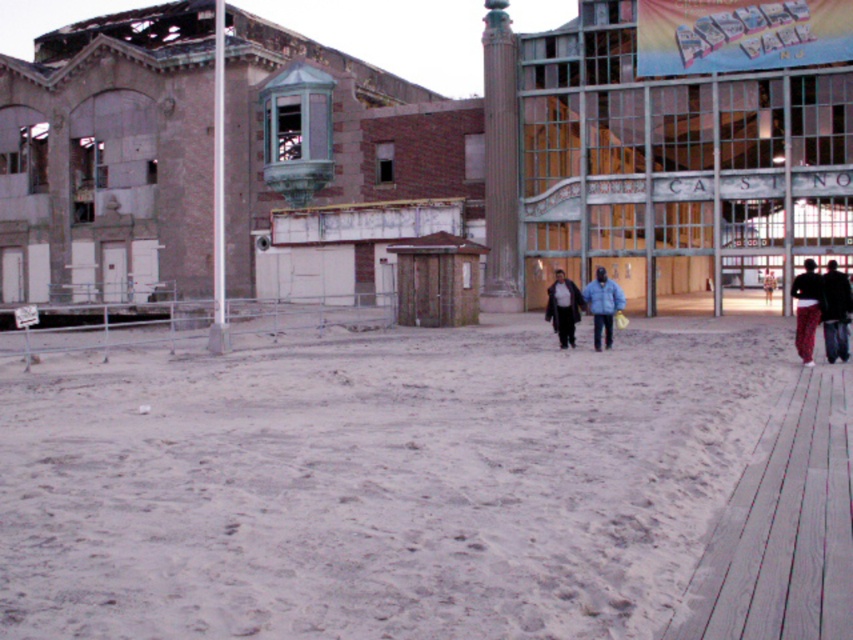
You are a photographer standing on the beach and want to capture both the dark blue jeans at lower right and the dark blue jacket at center in the same photo. Which object should you focus on first to ensure both are in frame?

To ensure both the dark blue jeans at lower right and the dark blue jacket at center are in frame, focus on the dark blue jeans at lower right first since it has a greater height and will occupy more space in the photo.

You are a photographer standing on the wooden boardwalk at the beach. You notice two people walking away from you towards the casino building. One is wearing dark blue jeans at lower right and the other has a dark blue jacket at center. Which of these two is positioned more to your right side?

The dark blue jeans at lower right is positioned on the right side of dark blue jacket at center, so the dark blue jeans at lower right is more to the right side.

You are standing at the point closer to the camera between the two points, point (828,268) and point (564,308). If you want to walk towards the building in the background, which direction should you move relative to these two points?

Since point (828,268) is closer to the camera than point (564,308), you are currently at point (828,268). To walk towards the building in the background, you should move towards point (564,308) as it is further away from the camera and closer to the building.